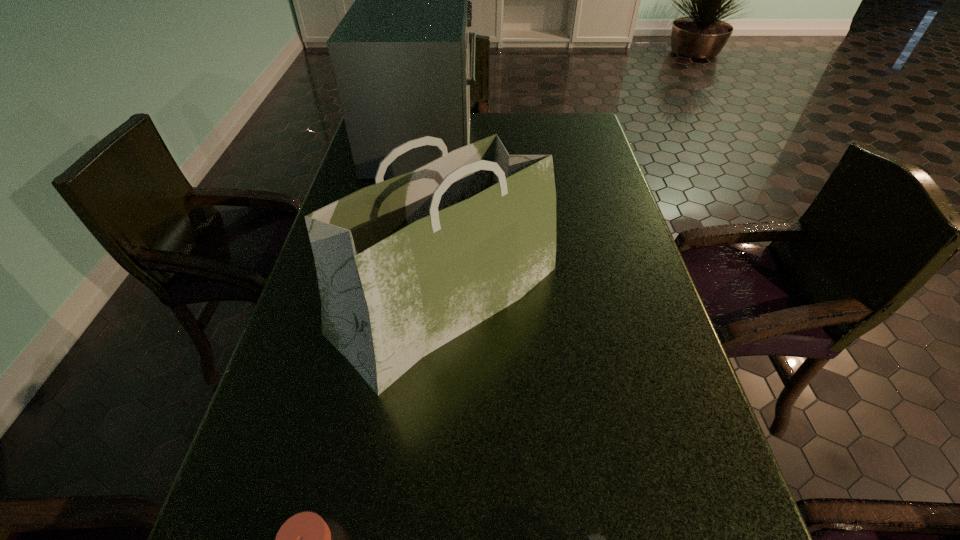
Find the location of a particular element. The height and width of the screenshot is (540, 960). toaster oven is located at coordinates (400, 56).

In order to click on grocery bag in this screenshot , I will do `click(405, 265)`.

This screenshot has height=540, width=960. Identify the location of vacant space positioned on the front panel of the farthest object. (549, 146).

The image size is (960, 540). What are the coordinates of `vacant space located on the front of the grocery bag` in the screenshot? It's located at (437, 433).

What are the coordinates of `object located in the far edge section of the desktop` in the screenshot? It's located at (400, 56).

The height and width of the screenshot is (540, 960). Identify the location of toaster oven located at the left edge. (400, 56).

Image resolution: width=960 pixels, height=540 pixels. Find the location of `grocery bag at the left edge`. grocery bag at the left edge is located at coordinates (405, 265).

The height and width of the screenshot is (540, 960). I want to click on object positioned at the far left corner, so click(400, 56).

Identify the location of free location at the far edge of the desktop. (523, 117).

This screenshot has height=540, width=960. What are the coordinates of `vacant space at the left edge` in the screenshot? It's located at (305, 400).